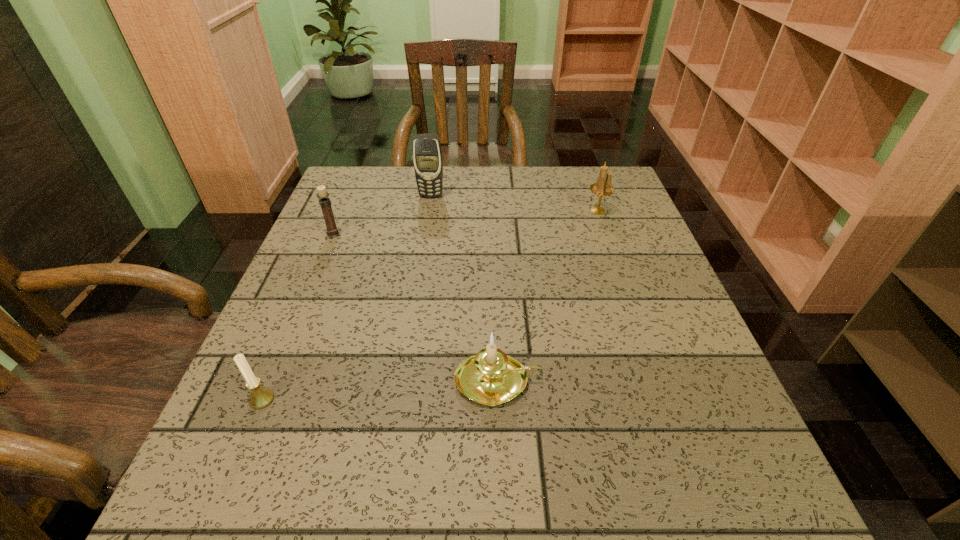
What are the coordinates of `cellular telephone located at the far edge` in the screenshot? It's located at (427, 156).

I want to click on candle holder that is at the far edge, so click(x=603, y=187).

You are a GUI agent. You are given a task and a screenshot of the screen. Output one action in this format:
    pyautogui.click(x=<x>, y=<y>)
    Task: Click on the object that is at the right edge
    The height and width of the screenshot is (540, 960).
    Given the screenshot: What is the action you would take?
    click(x=603, y=187)

Find the location of a particular element. The image size is (960, 540). object that is positioned at the far right corner is located at coordinates (603, 187).

This screenshot has height=540, width=960. What are the coordinates of `vacant area at the far edge` in the screenshot? It's located at (409, 199).

This screenshot has height=540, width=960. Identify the location of free space at the near edge of the desktop. (647, 512).

In the image, there is a desktop. In order to click on vacant area at the left edge in this screenshot , I will do `click(357, 296)`.

This screenshot has width=960, height=540. I want to click on vacant region at the right edge of the desktop, so click(x=602, y=230).

Find the location of a particular element. This screenshot has width=960, height=540. vacant space at the far left corner of the desktop is located at coordinates (375, 202).

Identify the location of vacant region at the near left corner. This screenshot has height=540, width=960. (291, 493).